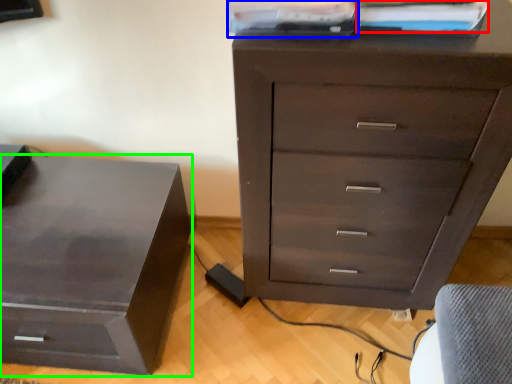
Question: Which object is positioned farthest from book (highlighted by a red box)? Select from book (highlighted by a blue box) and nightstand (highlighted by a green box).

Choices:
 (A) book
 (B) nightstand

Answer: (B)